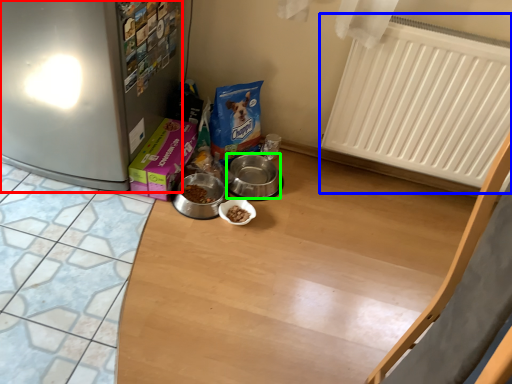
Question: Which is farther away from fridge (highlighted by a red box)? radiator (highlighted by a blue box) or appliance (highlighted by a green box)?

Choices:
 (A) radiator
 (B) appliance

Answer: (A)